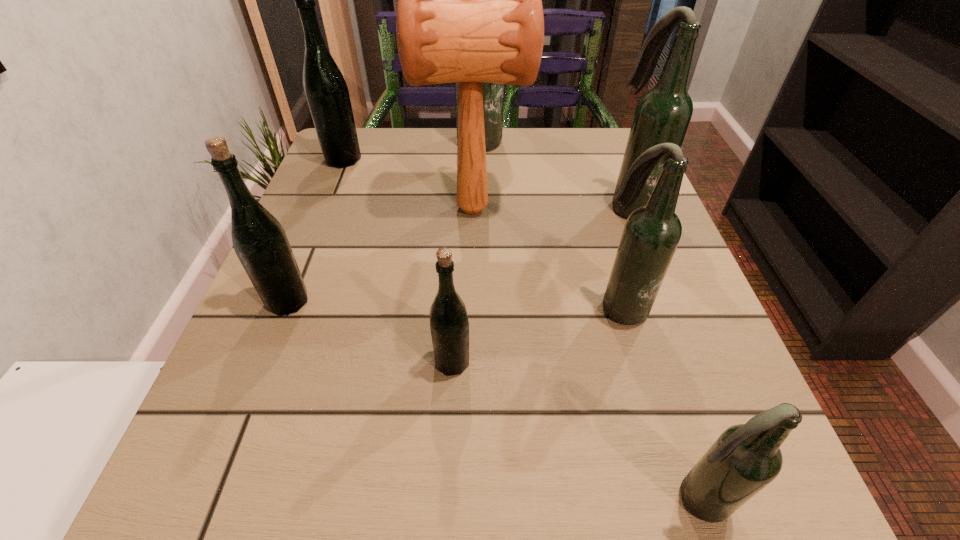
Locate an element on the screen. object located at the near edge is located at coordinates (x=745, y=458).

Find the location of a particular element. The width and height of the screenshot is (960, 540). object at the far left corner is located at coordinates (326, 91).

Image resolution: width=960 pixels, height=540 pixels. I want to click on object located at the near right corner, so click(745, 458).

At what (x,y) coordinates should I click in order to perform the action: click on free space at the far edge of the desktop. Please return your answer as a coordinate pair (x, y). This screenshot has height=540, width=960. Looking at the image, I should click on (555, 131).

This screenshot has width=960, height=540. Find the location of `vacant region at the near edge of the desktop`. vacant region at the near edge of the desktop is located at coordinates (446, 477).

I want to click on free spot at the left edge of the desktop, so click(332, 202).

This screenshot has width=960, height=540. I want to click on vacant space at the right edge of the desktop, so click(x=629, y=354).

Find the location of `free space at the far left corner`. free space at the far left corner is located at coordinates (392, 132).

This screenshot has width=960, height=540. In the image, there is a desktop. In order to click on free space at the near left corner in this screenshot , I will do `click(241, 477)`.

This screenshot has width=960, height=540. In order to click on vacant region at the near right corner of the desktop in this screenshot , I will do `click(680, 491)`.